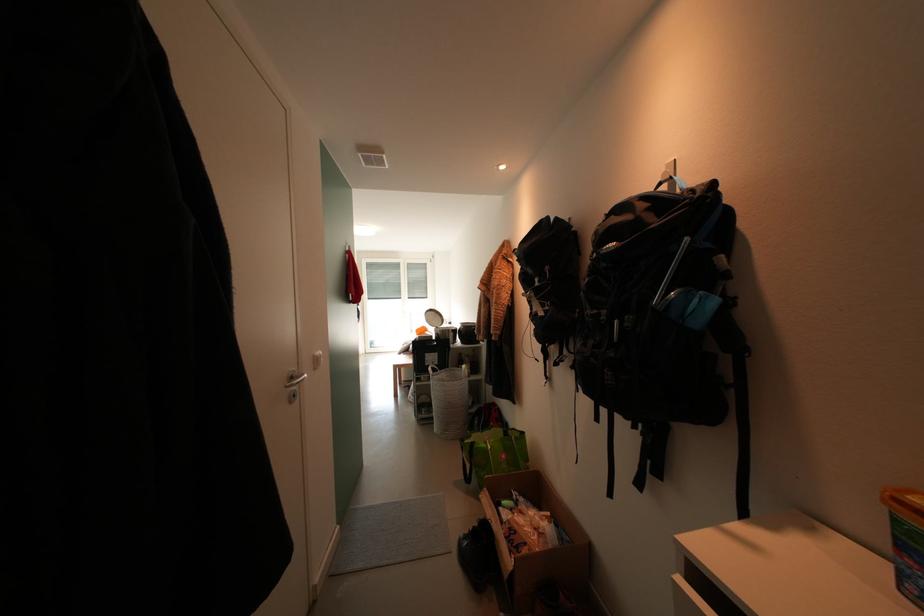
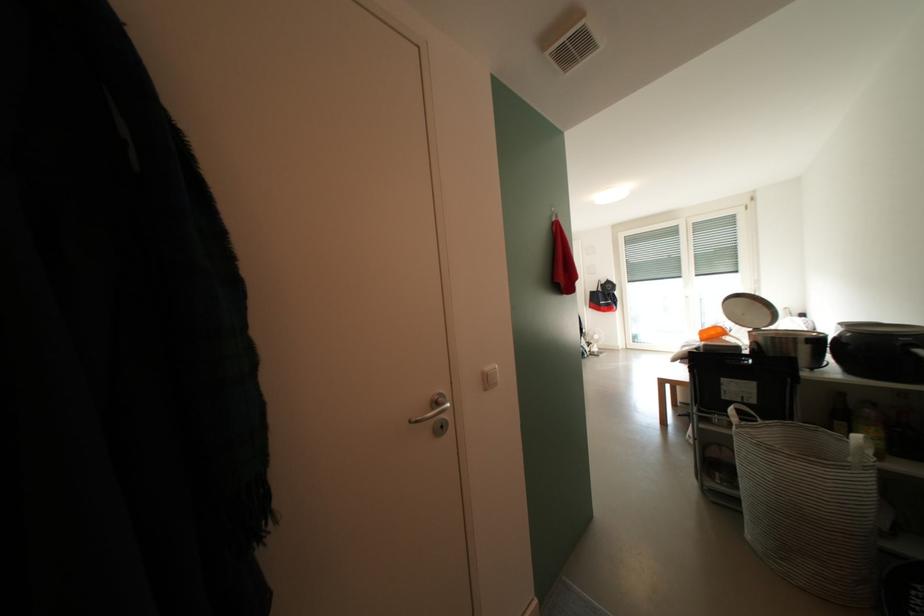
Find the pixel in the second image that matches point (442, 318) in the first image.

(756, 308)